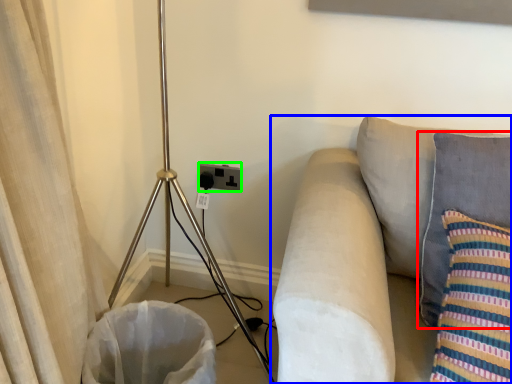
Question: Based on their relative distances, which object is farther from pillow (highlighted by a red box)? Choose from studio couch (highlighted by a blue box) and electric outlet (highlighted by a green box).

Choices:
 (A) studio couch
 (B) electric outlet

Answer: (B)